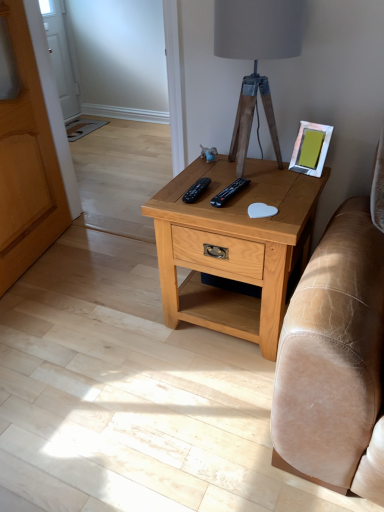
You are a GUI agent. You are given a task and a screenshot of the screen. Output one action in this format:
    pyautogui.click(x=<x>, y=<y>)
    Task: Click on the free location to the left of black plastic remote at center, placed as the first remote when sorted from left to right
    This screenshot has width=384, height=512.
    Given the screenshot: What is the action you would take?
    pyautogui.click(x=178, y=192)